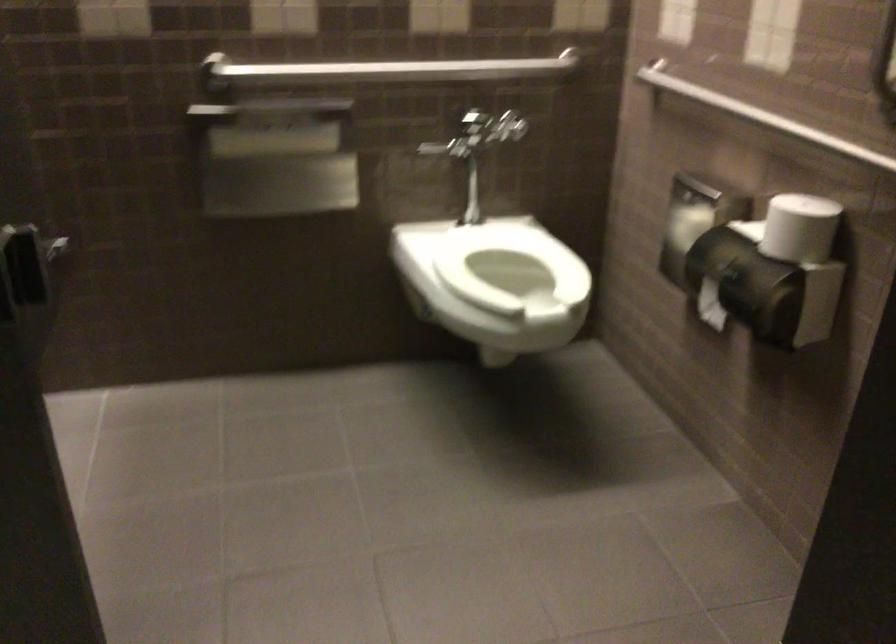
Image resolution: width=896 pixels, height=644 pixels. I want to click on white toilet seat, so click(509, 263).